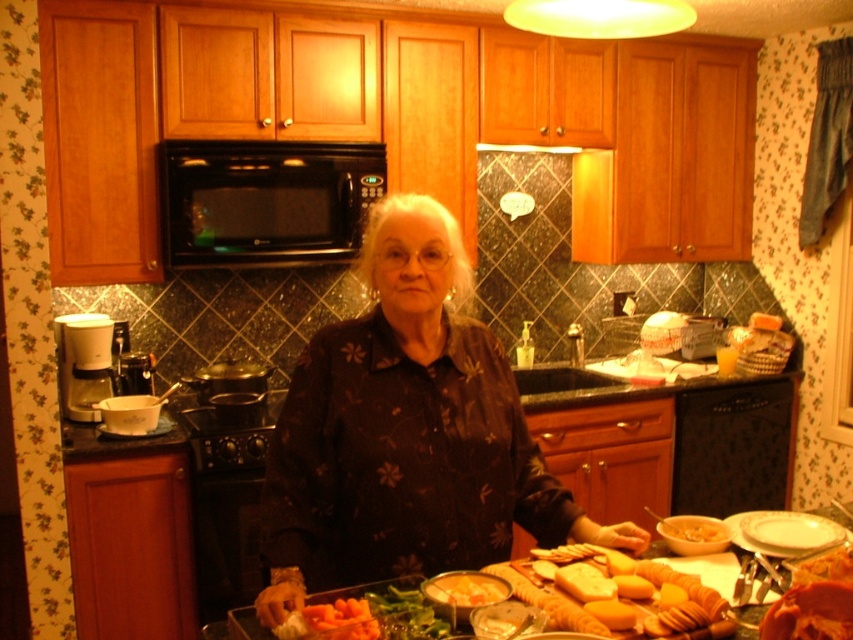
You are hosting a tea party and need to arrange snacks. You have two types of bread on the table. The yellowish matte bread at lower center and the yellow matte bread at center. Which bread is positioned more to the left side of the table?

The yellowish matte bread at lower center is positioned more to the left side of the table compared to the yellow matte bread at center.

You are a chef preparing a meal and need to reach the yellow matte bread at center. You are currently wearing the dark floral shirt at center. Will your shirt get in the way when you reach for the bread?

The dark floral shirt at center is 20.52 inches away from the yellow matte bread at center, so there is enough space between them. The shirt will not get in the way when reaching for the bread.